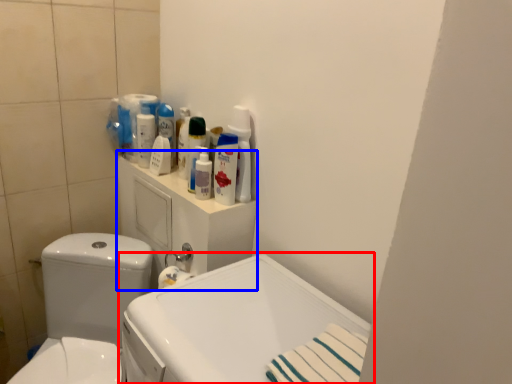
Question: Which point is further to the camera, sink (highlighted by a red box) or medicine cabinet (highlighted by a blue box)?

Choices:
 (A) sink
 (B) medicine cabinet

Answer: (B)